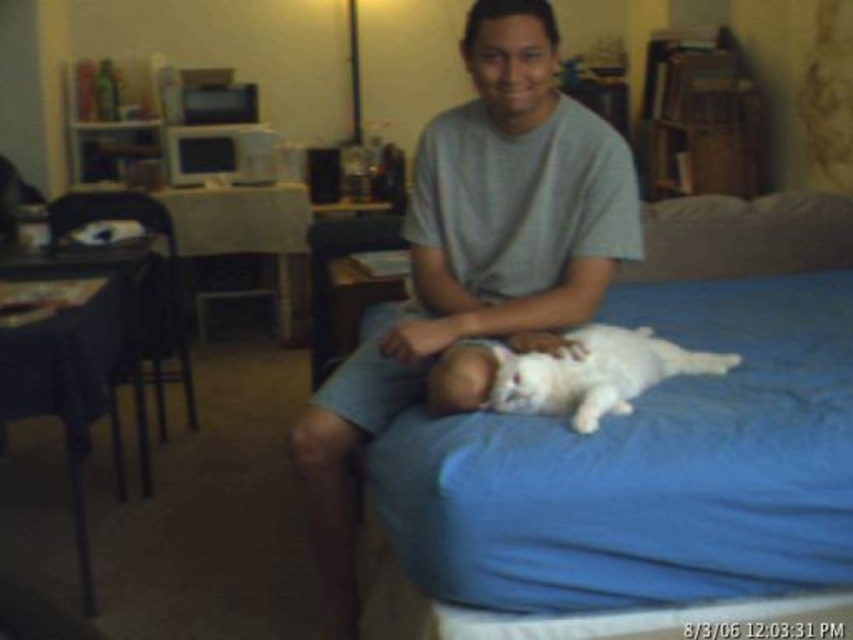
Question: Based on their relative distances, which object is nearer to the blue fabric pillow at upper right?

Choices:
 (A) blue fabric bed at center
 (B) white soft baby at center
 (C) gray cotton shirt at center

Answer: (A)

Question: Is gray cotton shirt at center to the right of white soft baby at center from the viewer's perspective?

Choices:
 (A) yes
 (B) no

Answer: (B)

Question: Estimate the real-world distances between objects in this image. Which object is farther from the gray cotton shirt at center?

Choices:
 (A) blue fabric bed at center
 (B) blue fabric pillow at upper right
 (C) white soft baby at center

Answer: (B)

Question: In this image, where is blue fabric bed at center located relative to blue fabric pillow at upper right?

Choices:
 (A) left
 (B) right

Answer: (A)

Question: Which object appears farthest from the camera in this image?

Choices:
 (A) gray cotton shirt at center
 (B) blue fabric bed at center
 (C) blue fabric pillow at upper right

Answer: (C)

Question: Is blue fabric bed at center below blue fabric pillow at upper right?

Choices:
 (A) no
 (B) yes

Answer: (B)